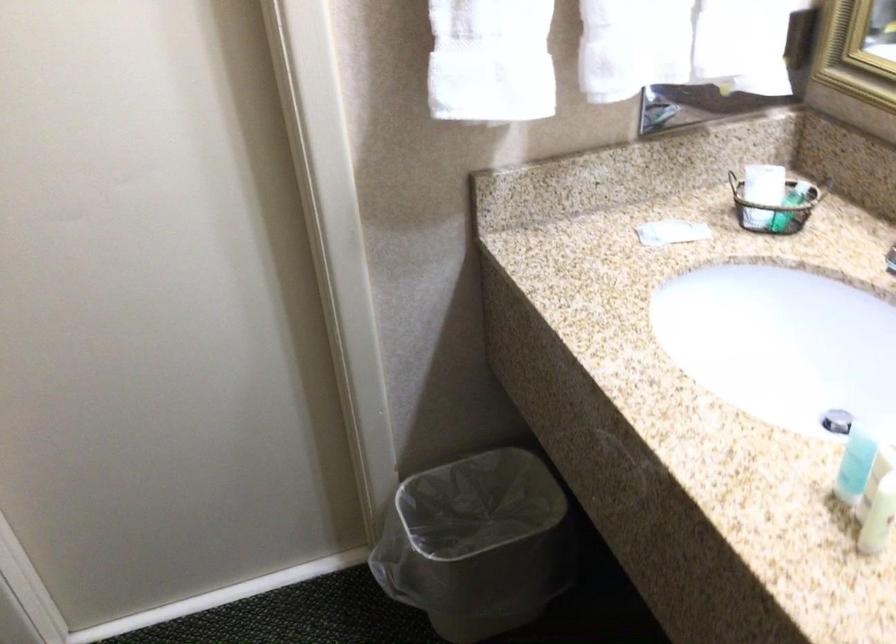
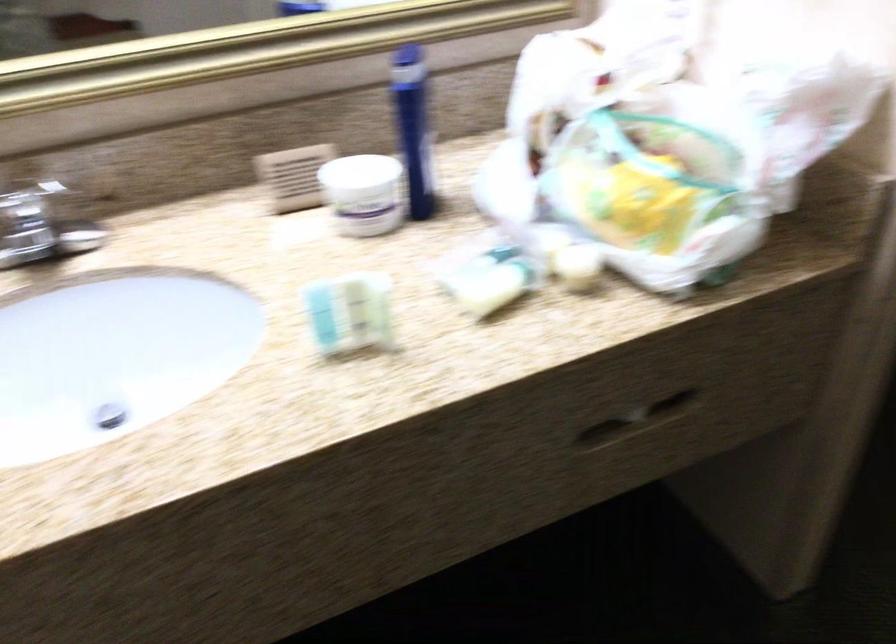
How did the camera likely rotate?

The camera's rotation is toward right-down.